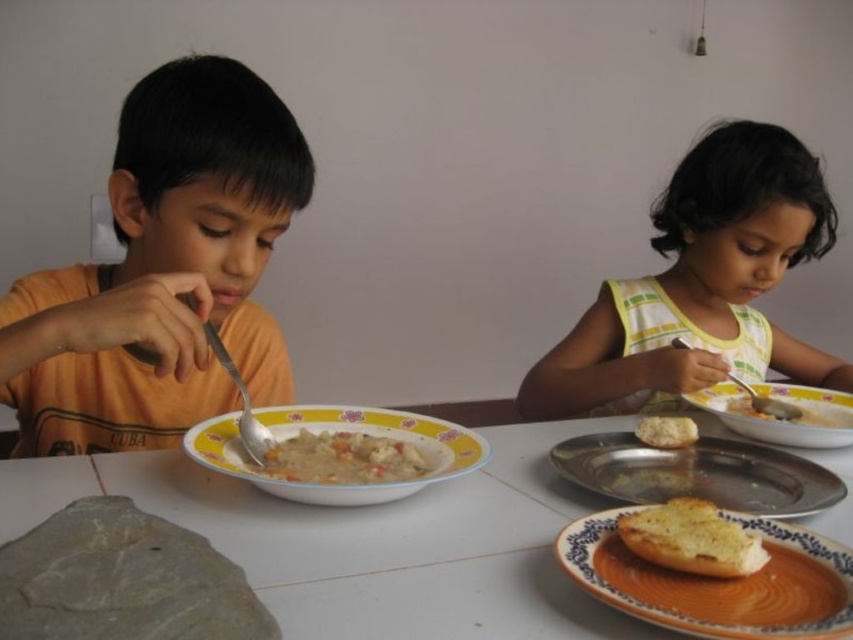
Question: Where is orange matte shirt at left located in relation to golden toasted bread at lower right in the image?

Choices:
 (A) right
 (B) left

Answer: (B)

Question: Does orange matte shirt at left appear on the right side of white bread at right?

Choices:
 (A) no
 (B) yes

Answer: (A)

Question: Which object is the closest to the yellow printed fabric at upper right?

Choices:
 (A) white glossy table at center
 (B) matte ceramic bowl at lower right
 (C) orange matte shirt at left
 (D) white bread at center

Answer: (B)

Question: Which of these objects is positioned closest to the orange glazed plate at lower right?

Choices:
 (A) white glossy table at center
 (B) white bread at right
 (C) orange matte shirt at left

Answer: (A)

Question: Which point is farther from the camera taking this photo?

Choices:
 (A) (849, 426)
 (B) (412, 452)
 (C) (190, 429)
 (D) (693, 436)

Answer: (A)

Question: Where is yellow printed fabric at upper right located in relation to white bread at right in the image?

Choices:
 (A) left
 (B) right

Answer: (A)